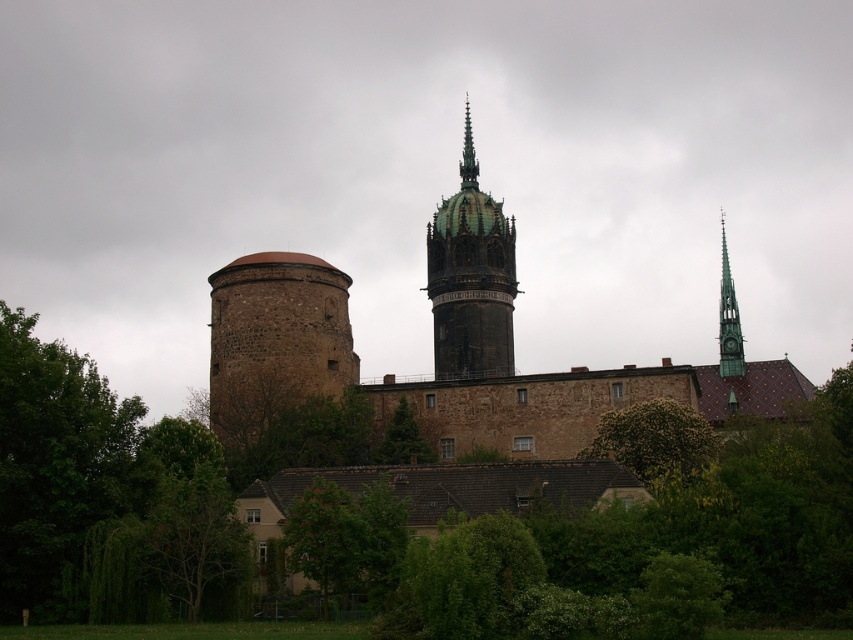
Does green leafy tree at lower left appear under green leafy tree at center?

Actually, green leafy tree at lower left is above green leafy tree at center.

Is point (45, 486) farther from viewer compared to point (392, 436)?

No, (45, 486) is in front of (392, 436).

Identify the location of green leafy tree at lower left. (57, 468).

Can you confirm if green leafy tree at center is positioned above shiny dark green spire at upper center?

No, green leafy tree at center is not above shiny dark green spire at upper center.

Is green leafy tree at center below shiny dark green spire at upper center?

Yes, green leafy tree at center is below shiny dark green spire at upper center.

Find the location of a particular element. green leafy tree at center is located at coordinates (403, 438).

Locate an element on the screen. green leafy tree at center is located at coordinates (403, 438).

Consider the image. Is dark brown stone tower at center to the right of green glazed tile spire at center from the viewer's perspective?

Yes, dark brown stone tower at center is to the right of green glazed tile spire at center.

Can you confirm if dark brown stone tower at center is wider than green glazed tile spire at center?

Yes, dark brown stone tower at center is wider than green glazed tile spire at center.

Identify the location of dark brown stone tower at center. coord(537,372).